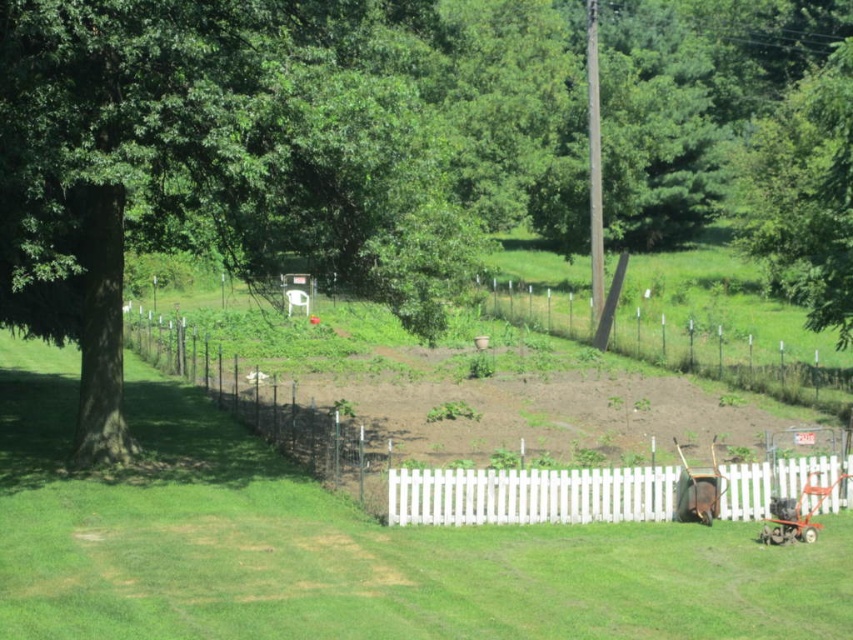
Is green leafy tree at upper left below rusty metal wheelbarrow at lower right?

No, green leafy tree at upper left is not below rusty metal wheelbarrow at lower right.

Can you confirm if green leafy tree at upper left is positioned to the right of rusty metal wheelbarrow at lower right?

Incorrect, green leafy tree at upper left is not on the right side of rusty metal wheelbarrow at lower right.

This screenshot has width=853, height=640. I want to click on green leafy tree at upper left, so click(x=227, y=161).

Can you confirm if white picket fence at lower right is positioned below metallic red baby carriage at lower right?

No.

Is white picket fence at lower right thinner than metallic red baby carriage at lower right?

In fact, white picket fence at lower right might be wider than metallic red baby carriage at lower right.

The image size is (853, 640). What do you see at coordinates (531, 496) in the screenshot?
I see `white picket fence at lower right` at bounding box center [531, 496].

This screenshot has height=640, width=853. What are the coordinates of `white picket fence at lower right` in the screenshot? It's located at (531, 496).

Does green leafy tree at upper left have a lesser height compared to white picket fence at lower right?

No, green leafy tree at upper left is not shorter than white picket fence at lower right.

Which is in front, point (137, 136) or point (770, 468)?

Point (137, 136) is in front.

This screenshot has height=640, width=853. Find the location of `green leafy tree at upper left`. green leafy tree at upper left is located at coordinates (227, 161).

Locate an element on the screen. Image resolution: width=853 pixels, height=640 pixels. green leafy tree at upper left is located at coordinates (227, 161).